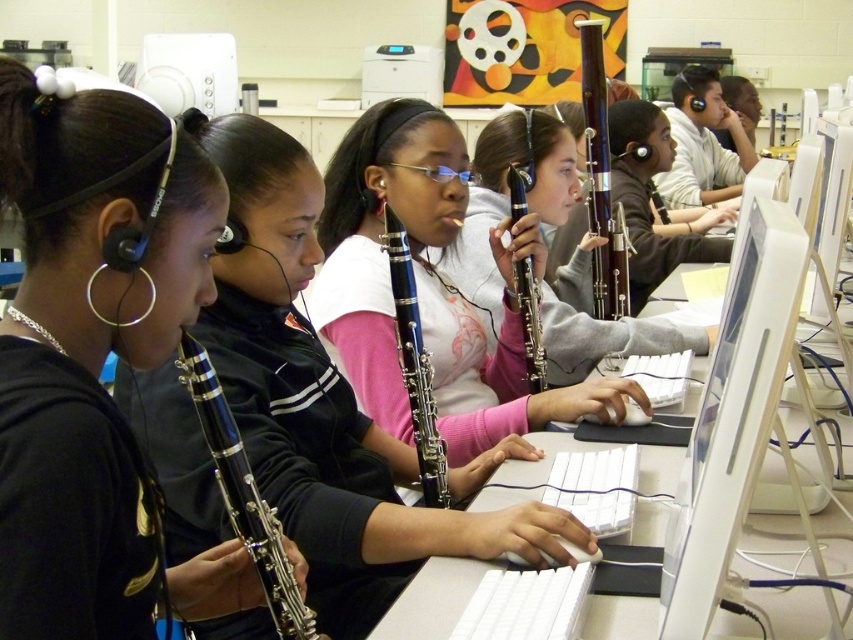
You are standing in the classroom and want to reach the point marked at coordinates point (709, 600). If your arm can extend 28 inches, can you reach it without moving your feet?

The distance between you and point (709, 600) is 28.54 inches. Since your arm can only extend 28 inches, you cannot reach it without moving your feet.

You are a student in the classroom and want to choose a clarinet for your music practice. Which clarinet, the matte blue clarinet at center or the black glossy clarinet at center, would you pick if you prefer a bigger instrument?

You should pick the matte blue clarinet at center because it is larger in size than the black glossy clarinet at center.